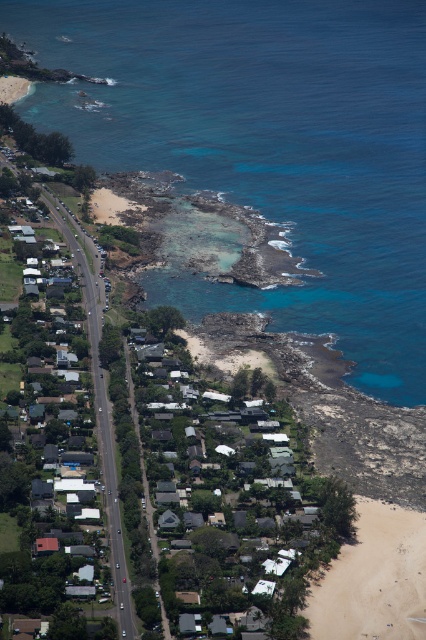
Can you confirm if blue clear water at center is positioned to the left of light brown sand at lower right?

Correct, you'll find blue clear water at center to the left of light brown sand at lower right.

Is point (391, 54) farther from camera compared to point (356, 522)?

Yes.

Locate an element on the screen. This screenshot has width=426, height=640. blue clear water at center is located at coordinates (265, 147).